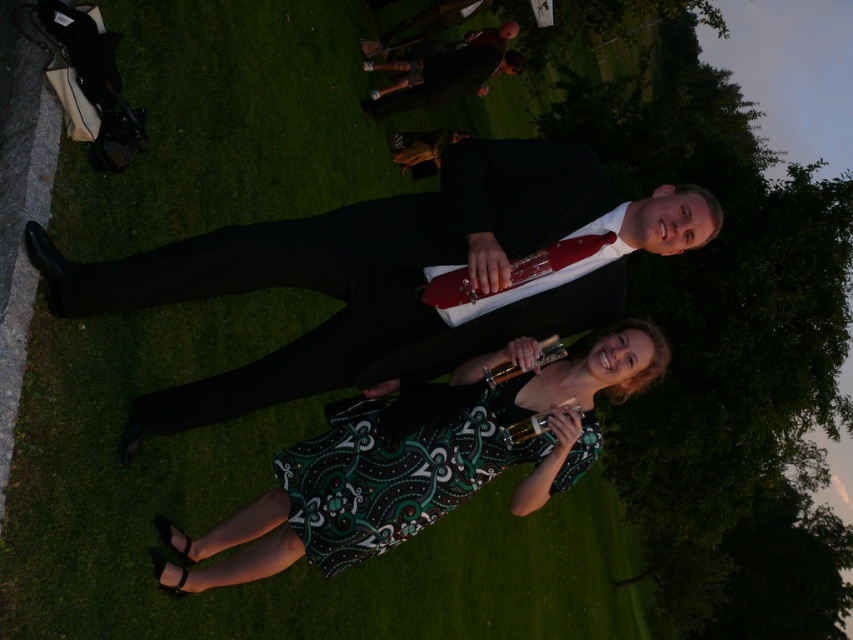
Consider the image. Is green paisley fabric dress at center further to camera compared to dark suit at upper center?

No, green paisley fabric dress at center is closer to the viewer.

Is green paisley fabric dress at center wider than dark suit at upper center?

No.

Where is `green paisley fabric dress at center`? This screenshot has height=640, width=853. green paisley fabric dress at center is located at coordinates (x=396, y=472).

Who is more forward, (451, 420) or (412, 504)?

Point (451, 420) is more forward.

The width and height of the screenshot is (853, 640). Identify the location of printed fabric dress at center. (421, 464).

Is black satin suit at center taller than dark suit at upper center?

In fact, black satin suit at center may be shorter than dark suit at upper center.

Looking at this image, is black satin suit at center smaller than dark suit at upper center?

Yes, black satin suit at center is smaller than dark suit at upper center.

Is point (247, 225) farther from viewer compared to point (520, 64)?

No.

Find the location of a particular element. Image resolution: width=853 pixels, height=640 pixels. black satin suit at center is located at coordinates (387, 275).